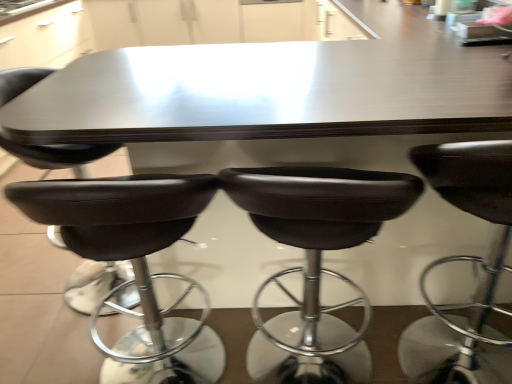
Question: Considering the positions of black leather stool at center, the 3th chair positioned from the left, and black leather stool at center, which is counted as the fourth chair, starting from the left, in the image, is black leather stool at center, the 3th chair positioned from the left, wider or thinner than black leather stool at center, which is counted as the fourth chair, starting from the left,?

Choices:
 (A) thin
 (B) wide

Answer: (A)

Question: In the image, is black leather stool at center, which is the third chair from right to left, positioned in front of or behind black leather stool at center, which is counted as the fourth chair, starting from the left?

Choices:
 (A) behind
 (B) front

Answer: (A)

Question: Based on their relative distances, which object is farther from the black leather chair at lower left, the second chair when ordered from left to right?

Choices:
 (A) black leather stool at lower left, positioned as the fifth chair in right-to-left order
 (B) black leather stool at center, which is the third chair from right to left
 (C) black leather stool at center, placed as the first chair when sorted from right to left
 (D) black leather stool at center, which is counted as the fourth chair, starting from the left

Answer: (C)

Question: Which of these objects is positioned farthest from the black leather stool at lower left, the first chair in the left-to-right sequence?

Choices:
 (A) black leather stool at center, which is the third chair from right to left
 (B) black leather stool at center, which is counted as the fourth chair, starting from the left
 (C) black leather stool at center, placed as the first chair when sorted from right to left
 (D) black leather chair at lower left, marked as the fourth chair in a right-to-left arrangement

Answer: (C)